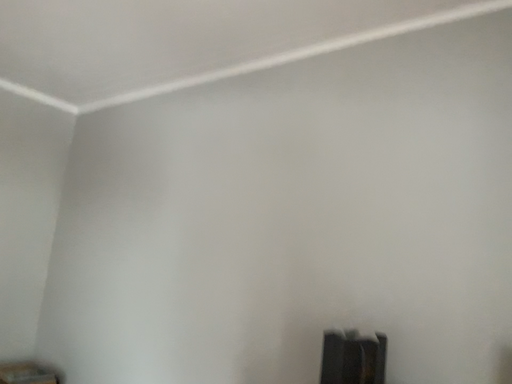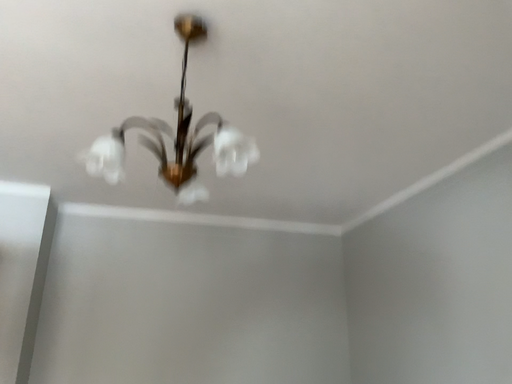
Question: How did the camera likely rotate when shooting the video?

Choices:
 (A) rotated upward
 (B) rotated downward

Answer: (A)